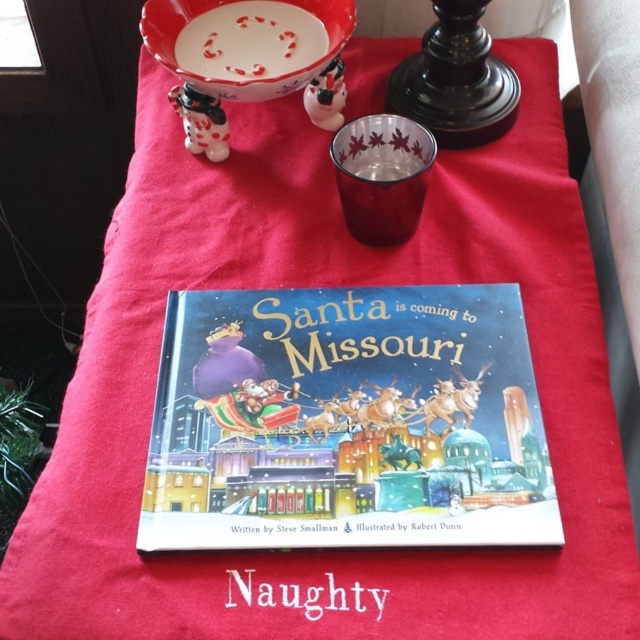
Does hardcover book at center appear under white ceramic bowl at upper center?

Indeed, hardcover book at center is positioned under white ceramic bowl at upper center.

Does hardcover book at center appear over white ceramic bowl at upper center?

Incorrect, hardcover book at center is not positioned above white ceramic bowl at upper center.

Between point (381, 490) and point (333, 19), which one is positioned in front?

Positioned in front is point (381, 490).

Locate an element on the screen. This screenshot has width=640, height=640. hardcover book at center is located at coordinates (346, 420).